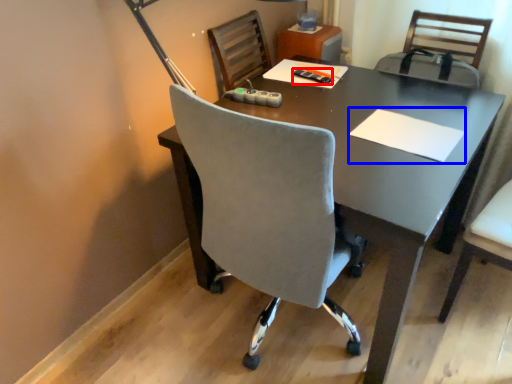
Question: Which point is further to the camera, stationery (highlighted by a red box) or notepad (highlighted by a blue box)?

Choices:
 (A) stationery
 (B) notepad

Answer: (A)